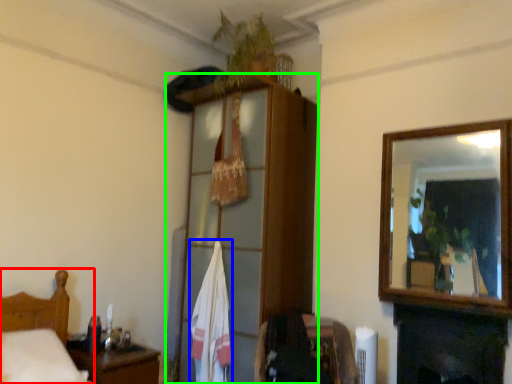
Question: Estimate the real-world distances between objects in this image. Which object is farther from furniture (highlighted by a red box), bath towel (highlighted by a blue box) or dresser (highlighted by a green box)?

Choices:
 (A) bath towel
 (B) dresser

Answer: (B)